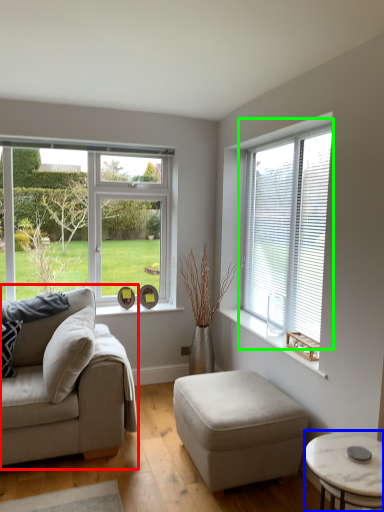
Question: Considering the real-world distances, which object is closest to studio couch (highlighted by a red box)? coffee table (highlighted by a blue box) or window (highlighted by a green box).

Choices:
 (A) coffee table
 (B) window

Answer: (A)